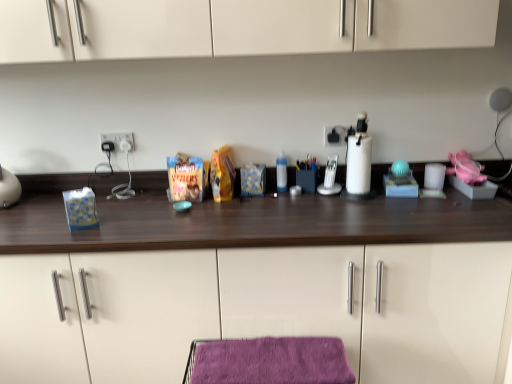
Question: Is purple velvet towel at lower center bigger than wooden countertop at center?

Choices:
 (A) yes
 (B) no

Answer: (B)

Question: Is purple velvet towel at lower center positioned beyond the bounds of wooden countertop at center?

Choices:
 (A) no
 (B) yes

Answer: (B)

Question: Is purple velvet towel at lower center far away from wooden countertop at center?

Choices:
 (A) no
 (B) yes

Answer: (A)

Question: Does purple velvet towel at lower center appear on the left side of wooden countertop at center?

Choices:
 (A) no
 (B) yes

Answer: (A)

Question: From a real-world perspective, is purple velvet towel at lower center located higher than wooden countertop at center?

Choices:
 (A) yes
 (B) no

Answer: (A)

Question: Is purple velvet towel at lower center positioned behind wooden countertop at center?

Choices:
 (A) yes
 (B) no

Answer: (B)

Question: Could you tell me if white plastic electric outlet at center, the 1th electric outlet when ordered from left to right, is facing silver metallic phone at center?

Choices:
 (A) yes
 (B) no

Answer: (B)

Question: From a real-world perspective, is white plastic electric outlet at center, the 1th electric outlet when ordered from left to right, physically below silver metallic phone at center?

Choices:
 (A) yes
 (B) no

Answer: (B)

Question: From a real-world perspective, does white plastic electric outlet at center, the 2th electric outlet positioned from the right, stand above silver metallic phone at center?

Choices:
 (A) no
 (B) yes

Answer: (B)

Question: Is white plastic electric outlet at center, the 1th electric outlet when ordered from left to right, touching silver metallic phone at center?

Choices:
 (A) no
 (B) yes

Answer: (A)

Question: Would you say silver metallic phone at center is part of white plastic electric outlet at center, the 2th electric outlet positioned from the right,'s contents?

Choices:
 (A) no
 (B) yes

Answer: (A)

Question: Can you confirm if white plastic electric outlet at center, the 2th electric outlet positioned from the right, is smaller than silver metallic phone at center?

Choices:
 (A) yes
 (B) no

Answer: (A)

Question: Is black plastic electric outlet at upper center, which is the second electric outlet in left-to-right order, surrounded by silver metallic phone at center?

Choices:
 (A) yes
 (B) no

Answer: (B)